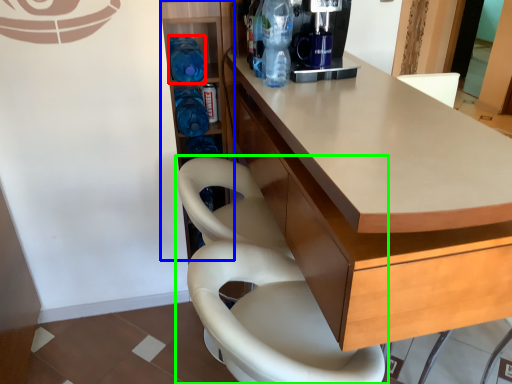
Question: Estimate the real-world distances between objects in this image. Which object is closer to bottle (highlighted by a red box), shelf (highlighted by a blue box) or chair (highlighted by a green box)?

Choices:
 (A) shelf
 (B) chair

Answer: (A)